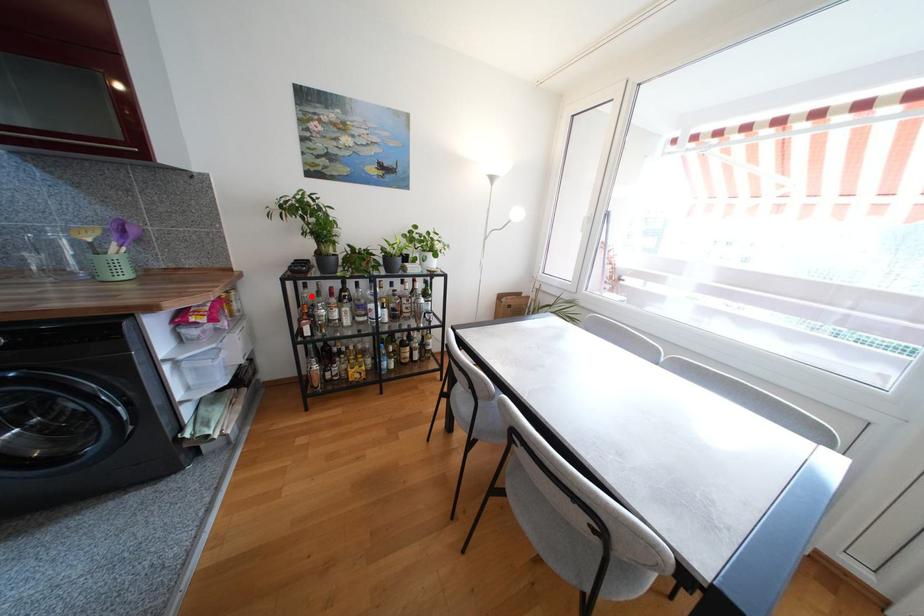
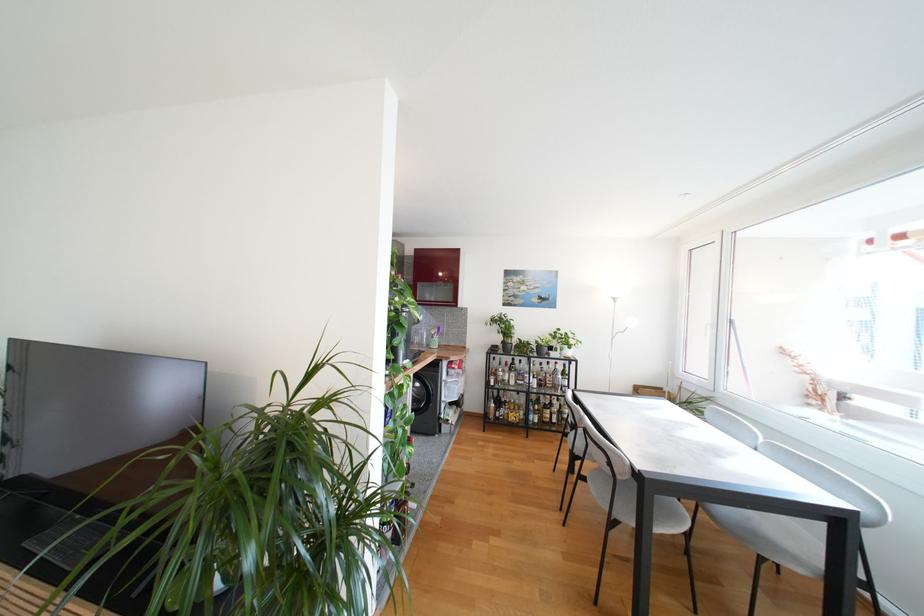
In the second image, find the point that corresponds to the highlighted location in the first image.

(497, 366)